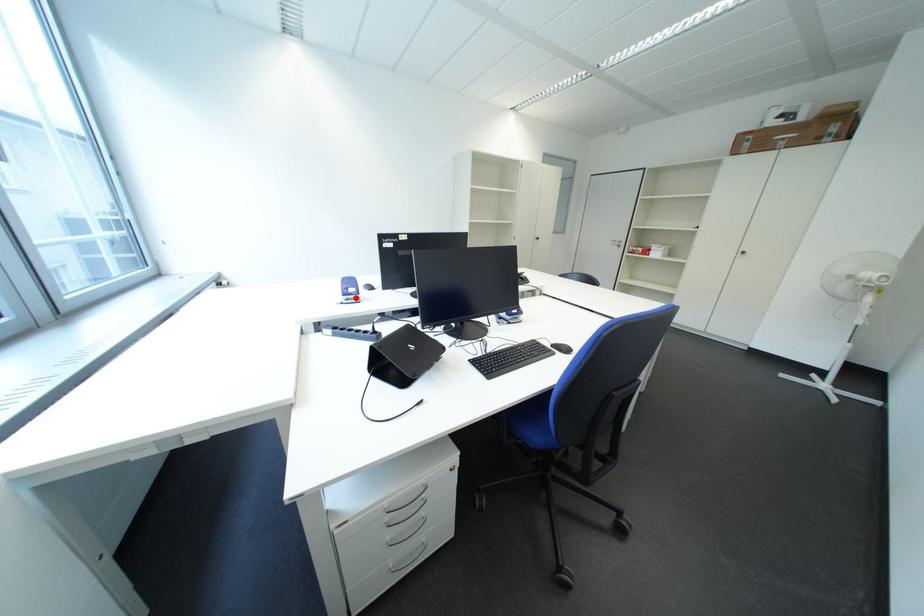
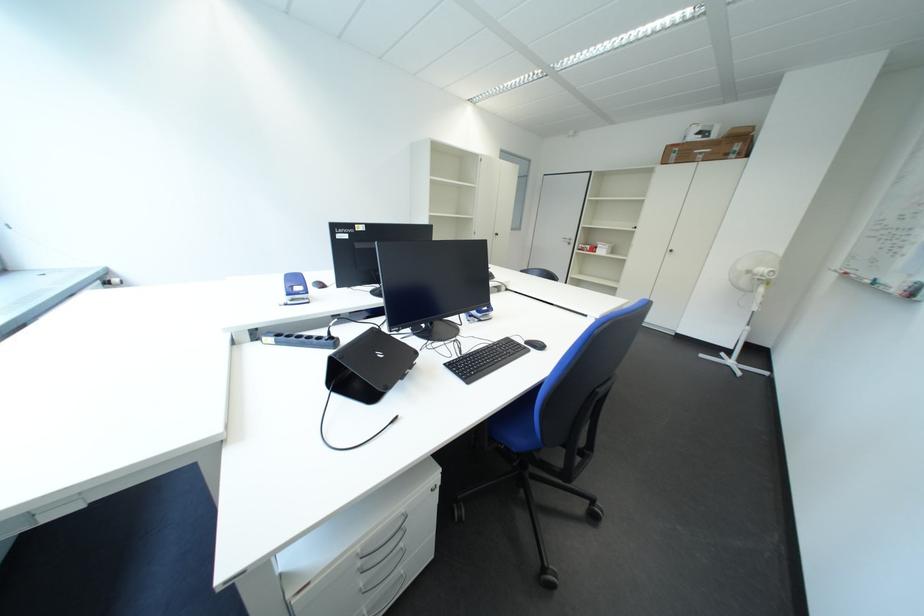
Where in the second image is the point corresponding to the highlighted location from the first image?

(300, 297)